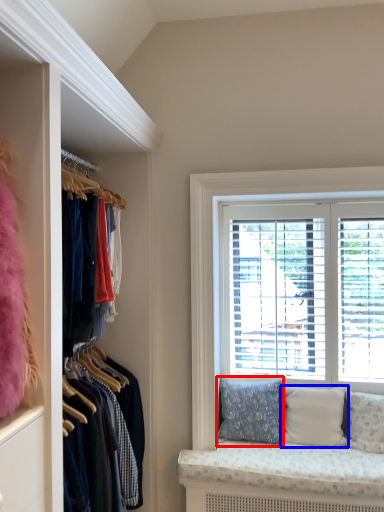
Question: Which of the following is the closest to the observer, pillow (highlighted by a red box) or pillow (highlighted by a blue box)?

Choices:
 (A) pillow
 (B) pillow

Answer: (B)